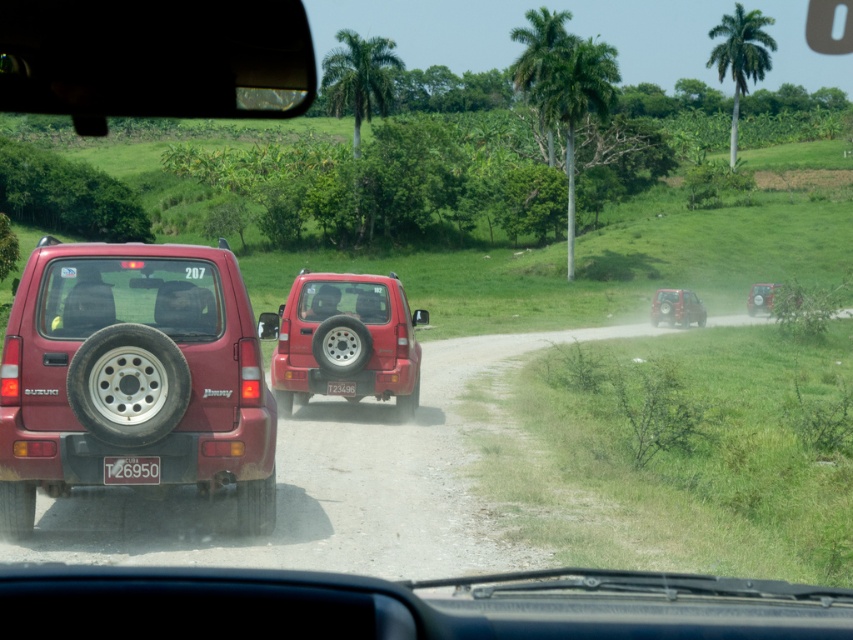
Is matte red suv at center thinner than white plastic license plate at center?

No, matte red suv at center is not thinner than white plastic license plate at center.

Is point (341, 285) positioned before point (347, 381)?

Yes.

Identify the location of matte red suv at center. Image resolution: width=853 pixels, height=640 pixels. (344, 337).

Who is more forward, (352, 323) or (126, 483)?

Point (126, 483) is more forward.

Is point (347, 336) positioned after point (126, 458)?

That is True.

Find the location of a particular element. silver metallic tire at center is located at coordinates (341, 344).

Does point (347, 362) lie in front of point (260, 508)?

No.

Measure the distance between silver metallic tire at center and black rubber tire at lower left.

They are 7.32 meters apart.

Which is behind, point (329, 360) or point (264, 477)?

The point (329, 360) is more distant.

I want to click on silver metallic tire at center, so click(341, 344).